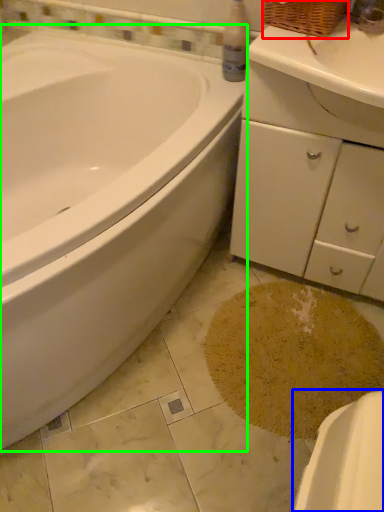
Question: Based on their relative distances, which object is farther from basket (highlighted by a red box)? Choose from porcelain (highlighted by a blue box) and bathtub (highlighted by a green box).

Choices:
 (A) porcelain
 (B) bathtub

Answer: (A)